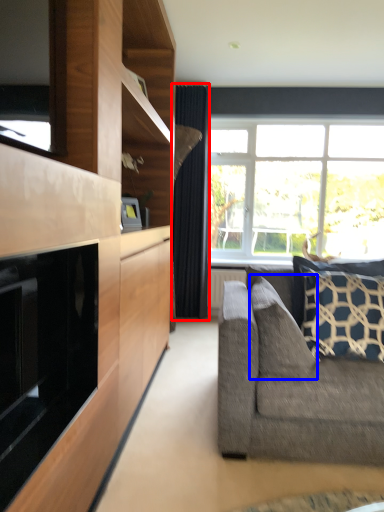
Question: Which of the following is the farthest to the observer, curtain (highlighted by a red box) or pillow (highlighted by a blue box)?

Choices:
 (A) curtain
 (B) pillow

Answer: (A)